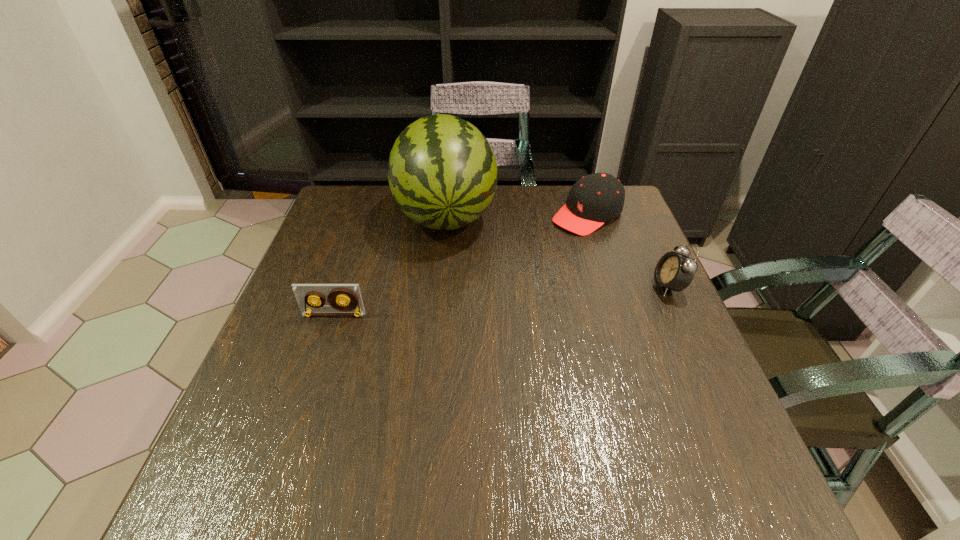
Locate an element on the screen. The height and width of the screenshot is (540, 960). the nearest object is located at coordinates (305, 293).

I want to click on the leftmost object, so click(305, 293).

You are a GUI agent. You are given a task and a screenshot of the screen. Output one action in this format:
    pyautogui.click(x=<x>, y=<y>)
    Task: Click on the second nearest object
    
    Given the screenshot: What is the action you would take?
    pyautogui.click(x=674, y=271)

The height and width of the screenshot is (540, 960). Find the location of `cap`. cap is located at coordinates (597, 198).

The image size is (960, 540). I want to click on watermelon, so click(442, 172).

Where is `the tallest object`? the tallest object is located at coordinates (442, 172).

I want to click on vacant region located at the front of the leftmost object with visible reels, so click(321, 353).

In order to click on free point located on the face of the alarm clock in this screenshot , I will do `click(612, 286)`.

The height and width of the screenshot is (540, 960). Identify the location of free space located 0.060m on the face of the alarm clock. pyautogui.click(x=629, y=286).

Locate an element on the screen. This screenshot has height=540, width=960. vacant space located on the face of the alarm clock is located at coordinates (575, 286).